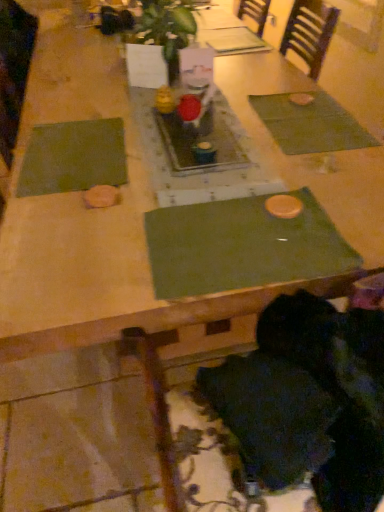
Locate an element on the screen. free space above green fabric place mat at left, which ranks as the 1th place mat in left-to-right order (from a real-world perspective) is located at coordinates (x=85, y=150).